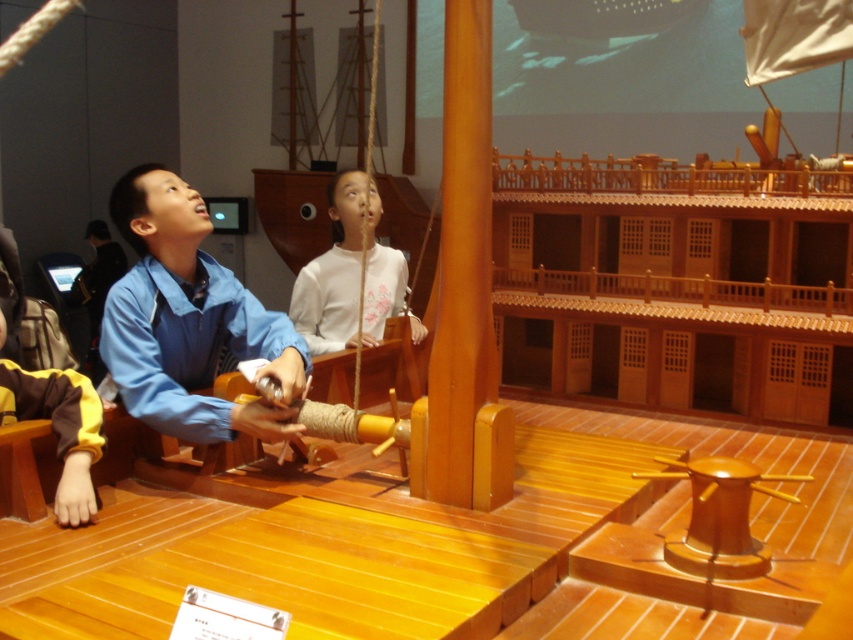
Can you confirm if blue fabric shirt at center is bigger than yellow fabric sleeve at lower left?

Yes, blue fabric shirt at center is bigger than yellow fabric sleeve at lower left.

Between point (241, 412) and point (3, 396), which one is positioned in front?

Point (3, 396) is more forward.

Identify the location of blue fabric shirt at center. The width and height of the screenshot is (853, 640). (189, 321).

Describe the element at coordinates (189, 321) in the screenshot. This screenshot has height=640, width=853. I see `blue fabric shirt at center` at that location.

Which is in front, point (241, 406) or point (374, 196)?

Point (241, 406) is in front.

Between point (200, 435) and point (337, 259), which one is positioned in front?

Positioned in front is point (200, 435).

I want to click on blue fabric shirt at center, so click(189, 321).

Is white matte shirt at center positioned before yellow fabric sleeve at lower left?

No, white matte shirt at center is further to the viewer.

Between white matte shirt at center and yellow fabric sleeve at lower left, which one has more height?

Standing taller between the two is white matte shirt at center.

What are the coordinates of `white matte shirt at center` in the screenshot? It's located at (332, 273).

Locate an element on the screen. This screenshot has width=853, height=640. white matte shirt at center is located at coordinates (332, 273).